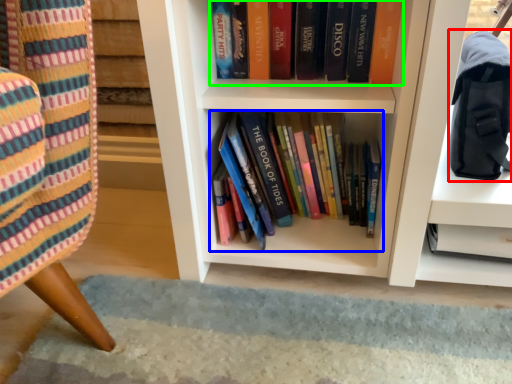
Question: Which object is the farthest from shoulder bag (highlighted by a red box)? Choose among these: book (highlighted by a blue box) or book (highlighted by a green box).

Choices:
 (A) book
 (B) book

Answer: (A)